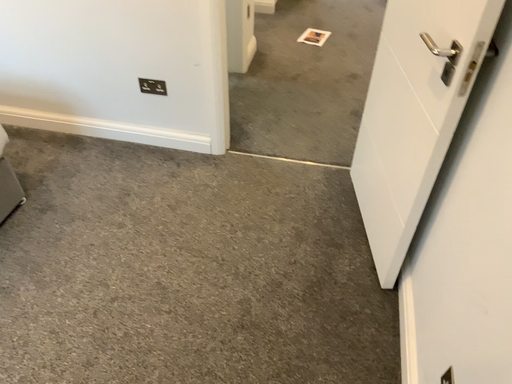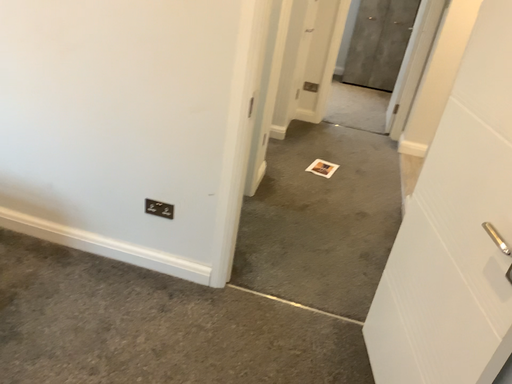
Question: Which way did the camera rotate in the video?

Choices:
 (A) rotated downward
 (B) rotated upward

Answer: (B)